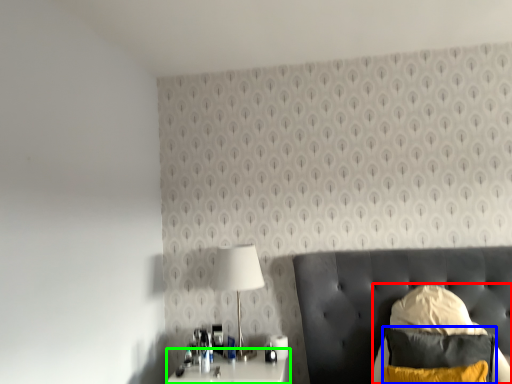
Question: Considering the real-world distances, which object is closest to swivel chair (highlighted by a red box)? pillow (highlighted by a blue box) or nightstand (highlighted by a green box).

Choices:
 (A) pillow
 (B) nightstand

Answer: (A)